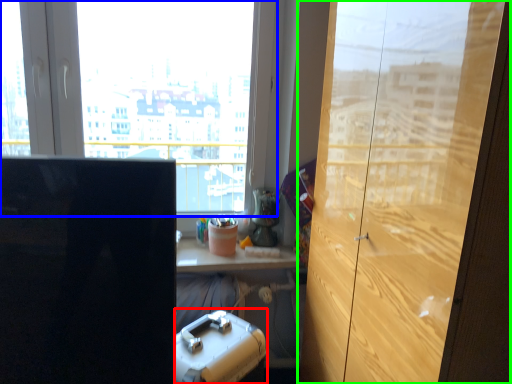
Question: Which object is the closest to the stationery (highlighted by a red box)? Choose among these: window (highlighted by a blue box) or cupboard (highlighted by a green box).

Choices:
 (A) window
 (B) cupboard

Answer: (B)